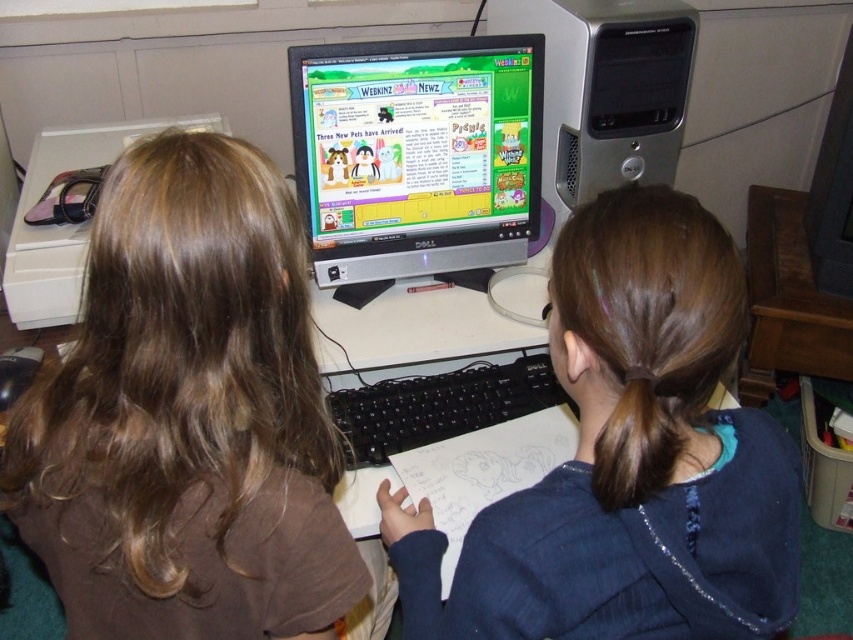
Is dark blue sweater at center thinner than matte silver monitor at center?

Incorrect, dark blue sweater at center's width is not less than matte silver monitor at center's.

What do you see at coordinates (628, 458) in the screenshot?
I see `dark blue sweater at center` at bounding box center [628, 458].

Image resolution: width=853 pixels, height=640 pixels. I want to click on dark blue sweater at center, so click(x=628, y=458).

Between brown matte hair at upper left and matte silver monitor at center, which one is positioned lower?

brown matte hair at upper left

The width and height of the screenshot is (853, 640). Identify the location of brown matte hair at upper left. (187, 416).

Identify the location of brown matte hair at upper left. Image resolution: width=853 pixels, height=640 pixels. (187, 416).

Is the position of brown matte hair at upper left less distant than that of dark blue sweater at center?

Yes.

Is brown matte hair at upper left bigger than dark blue sweater at center?

No.

Identify the location of brown matte hair at upper left. (187, 416).